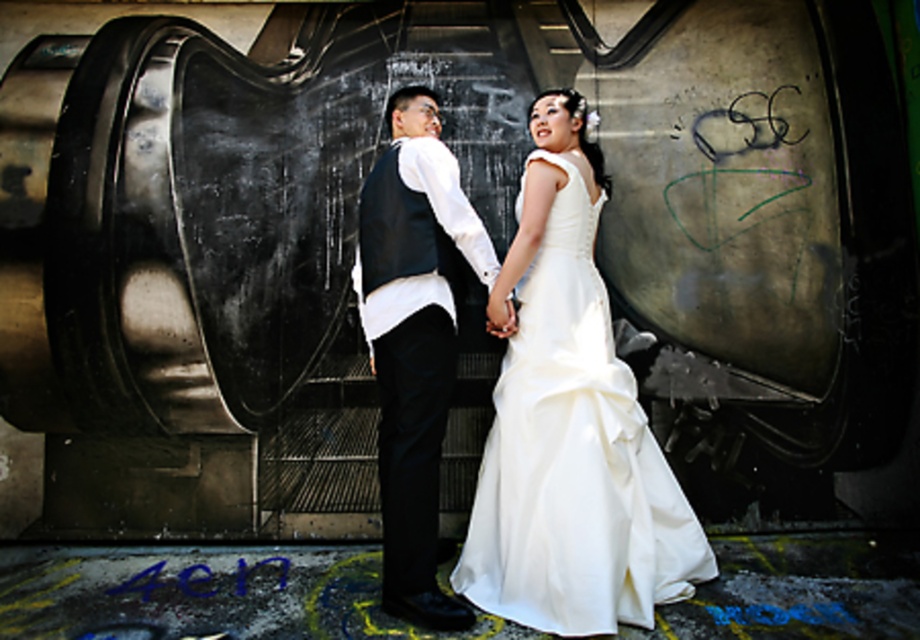
You are a photographer at a wedding. You have to take a photo where the white satin dress at center and the matte black vest at center are clearly visible. Based on their positions, which one is lower in the image?

The white satin dress at center is positioned under the matte black vest at center, so it is lower in the image.

You are a photographer setting up for a wedding photo shoot. You need to ensure that both the white satin dress at center and the matte black vest at center are fully visible in the frame. Given their sizes, which one might require more space horizontally to accommodate its width?

The white satin dress at center has a larger width than the matte black vest at center, so it would require more horizontal space to ensure it is fully visible in the frame.

You are a photographer setting up for a wedding photo shoot. You need to ensure that both the white satin dress at center and the matte black vest at center are clearly visible in the frame. Given their sizes, which one might require more careful positioning to avoid being overshadowed?

The white satin dress at center is larger in size than the matte black vest at center, so the matte black vest at center might require more careful positioning to avoid being overshadowed by the larger dress.